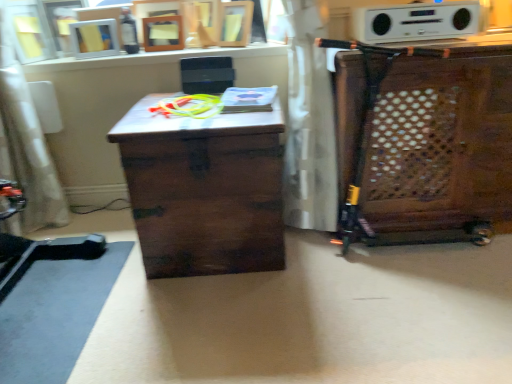
Find the location of a particular element. vacant area on top of dark wood trunk at center (from a real-world perspective) is located at coordinates (196, 104).